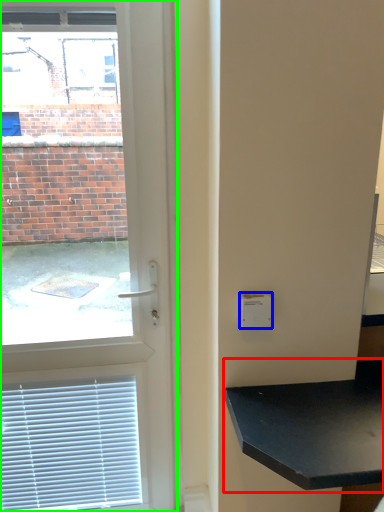
Question: Considering the real-world distances, which object is closest to table (highlighted by a red box)? light switch (highlighted by a blue box) or door (highlighted by a green box).

Choices:
 (A) light switch
 (B) door

Answer: (A)